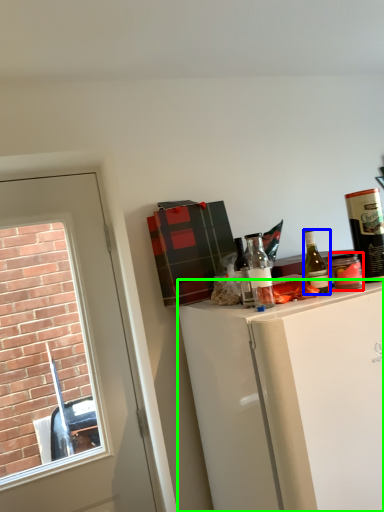
Question: Considering the real-world distances, which object is closest to beverage (highlighted by a red box)? bottle (highlighted by a blue box) or cabinetry (highlighted by a green box).

Choices:
 (A) bottle
 (B) cabinetry

Answer: (A)